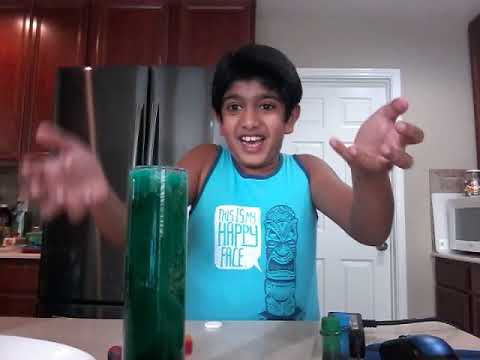
Find the location of `mouse`. mouse is located at coordinates (419, 342).